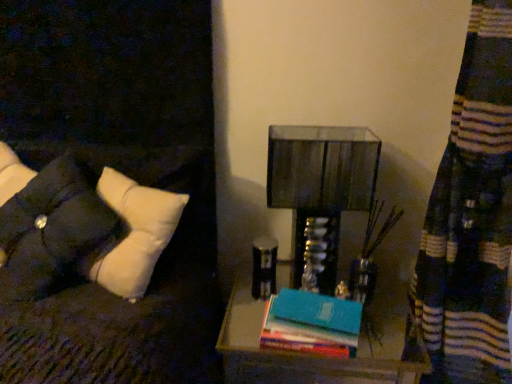
Question: Is point (114, 347) positioned closer to the camera than point (375, 360)?

Choices:
 (A) closer
 (B) farther

Answer: (A)

Question: Relative to wooden nightstand at lower right, is white fabric pillow at left in front or behind?

Choices:
 (A) front
 (B) behind

Answer: (A)

Question: Which object is the farthest from the tufted fabric pillow at left?

Choices:
 (A) teal matte book at center
 (B) white fabric pillow at left
 (C) wooden nightstand at lower right
 (D) metallic glass table lamp at center

Answer: (C)

Question: Estimate the real-world distances between objects in this image. Which object is closer to the tufted fabric pillow at left?

Choices:
 (A) white fabric pillow at left
 (B) teal matte book at center
 (C) metallic glass table lamp at center
 (D) wooden nightstand at lower right

Answer: (A)